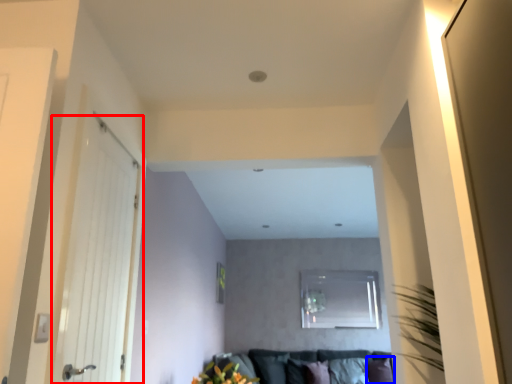
Question: Among these objects, which one is farthest to the camera, door (highlighted by a red box) or pillow (highlighted by a blue box)?

Choices:
 (A) door
 (B) pillow

Answer: (B)